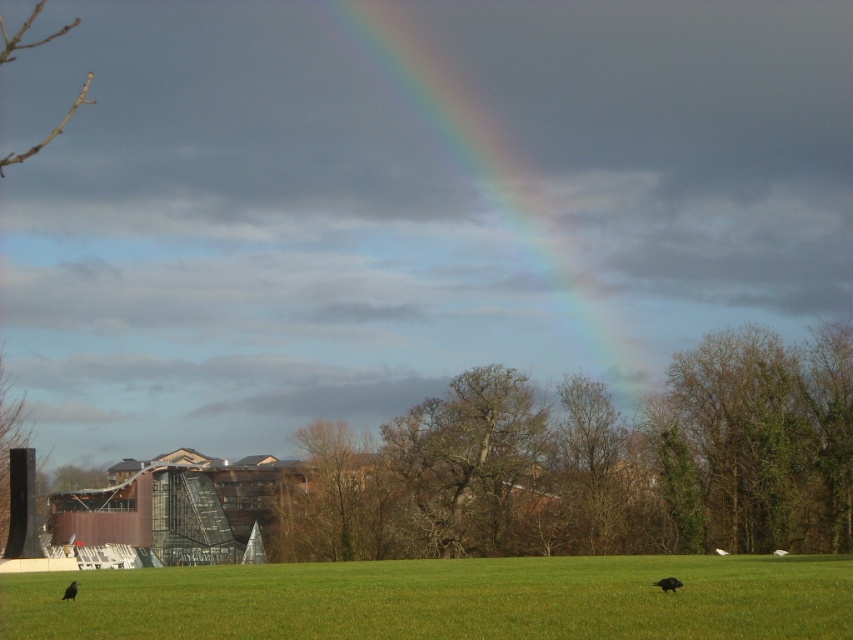
You are standing in the middle of the grassy field and want to take a photo of both the brown leafless tree at center and the rainbow at upper center. Which object should you focus on first to ensure both are in the same frame?

You should focus on the brown leafless tree at center first because it is closer to you than the rainbow at upper center, allowing both to be captured in the same frame when focused properly.